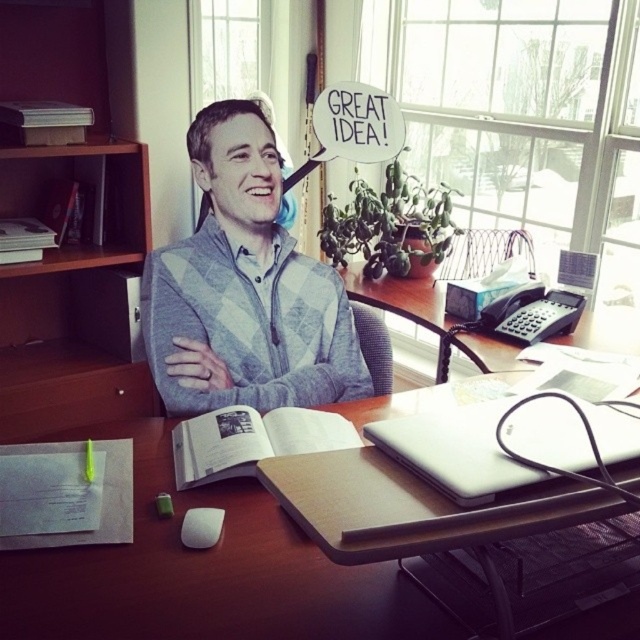
You are organizing the desk items and need to place a new item in front of the gray checkered sweater at center. Can the white matte laptop at center stay in its current position without moving?

The white matte laptop at center is currently behind the gray checkered sweater at center, so if you place a new item in front of the gray checkered sweater at center, the laptop can remain in its position as it is already behind the sweater.

You are standing in an office and see the point marked at coordinates (244, 289). What object is located at that position?

The point at coordinates (244, 289) corresponds to the gray checkered sweater at center.

You are an interior designer planning to place a new lamp on the desk. The lamp requires a space of 10 cm in diameter. Considering the current items on the desk, including the gray checkered sweater at center, is there enough space to place the lamp without overlapping any objects?

The gray checkered sweater at center is located at point [244,289]. However, without knowing the exact dimensions and positions of other desk items, it is impossible to determine if there is sufficient space for the lamp. Please provide more details about the desk layout.